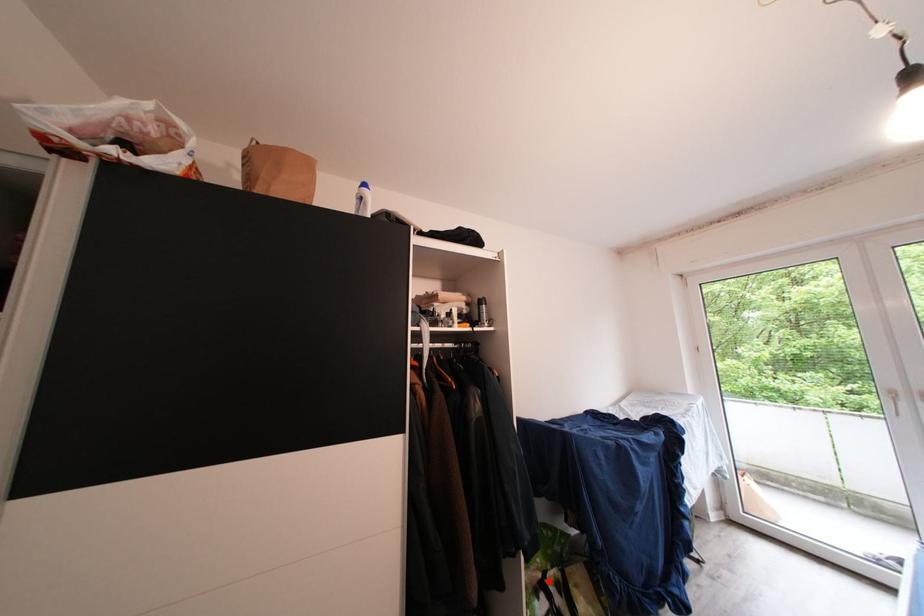
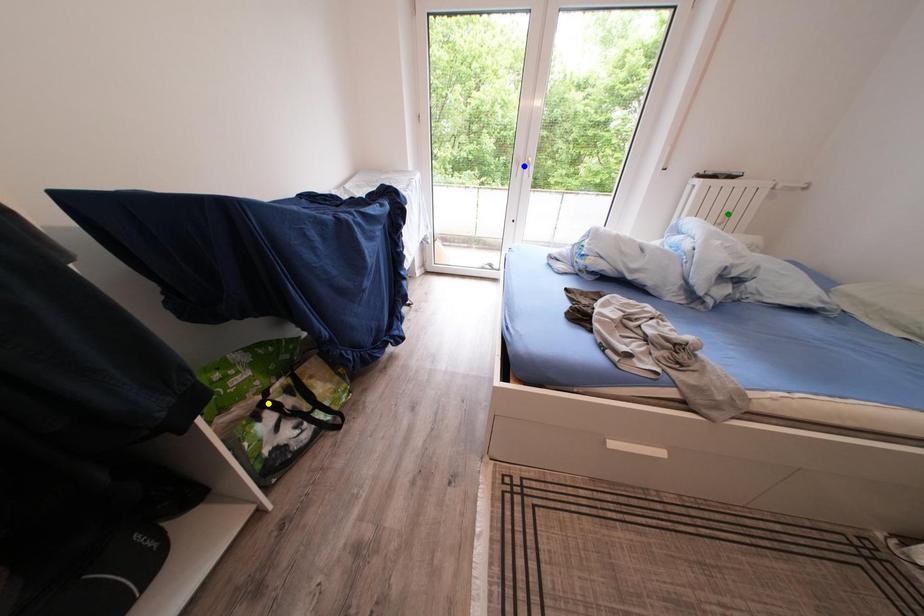
Question: I am providing you with two images of the same scene from different viewpoints. A red point is marked on the first image. You are given multiple points on the second image. In image 2, which mark is for the same physical point as the one in image 1?

Choices:
 (A) blue point
 (B) green point
 (C) yellow point

Answer: (C)